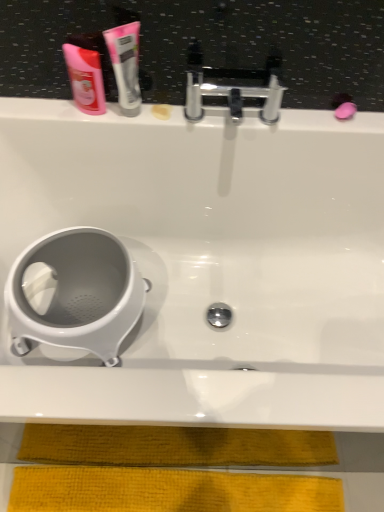
Find the location of a particular element. free region on the left part of pink glossy mouthwash at upper left is located at coordinates (48, 114).